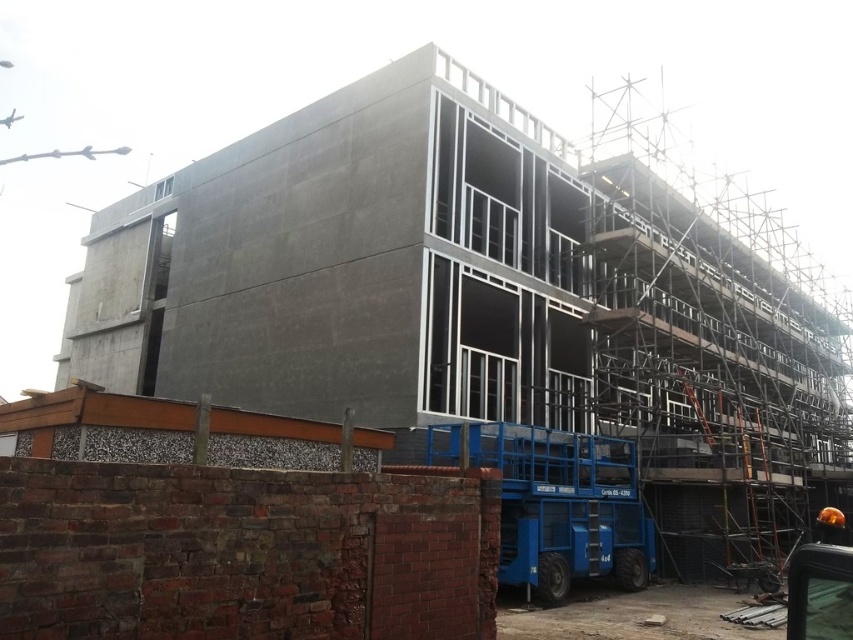
Can you confirm if metallic scaffolding at right is positioned to the right of shiny orange helmet at lower right?

Yes, metallic scaffolding at right is to the right of shiny orange helmet at lower right.

Which is below, metallic scaffolding at right or shiny orange helmet at lower right?

Positioned lower is shiny orange helmet at lower right.

Between point (607, 406) and point (821, 513), which one is positioned behind?

Positioned behind is point (607, 406).

Identify the location of metallic scaffolding at right. (711, 353).